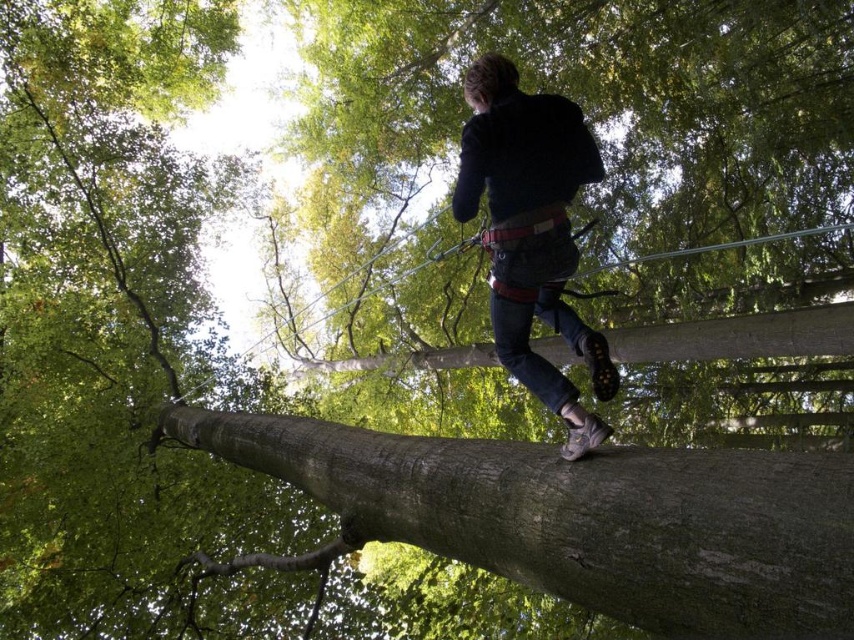
Find the location of a particular element. This screenshot has width=854, height=640. brown rough tree trunk at center is located at coordinates (583, 516).

Is point (680, 477) positioned in front of point (530, 204)?

Yes, point (680, 477) is in front of point (530, 204).

Identify the location of brown rough tree trunk at center. This screenshot has width=854, height=640. (583, 516).

Find the location of a particular element. This screenshot has height=640, width=854. brown rough tree trunk at center is located at coordinates (583, 516).